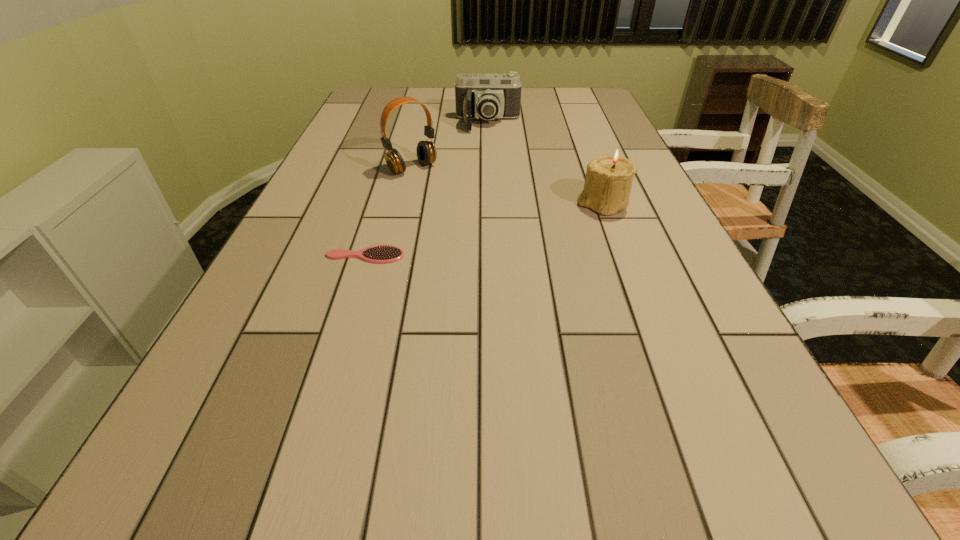
This screenshot has width=960, height=540. I want to click on unoccupied position between the second farthest object and the camera, so click(450, 146).

The width and height of the screenshot is (960, 540). I want to click on empty space between the third farthest object and the farthest object, so click(546, 164).

This screenshot has width=960, height=540. Find the location of `empty space that is in between the candle_holder and the hairbrush`. empty space that is in between the candle_holder and the hairbrush is located at coordinates (484, 230).

Find the location of a particular element. Image resolution: width=960 pixels, height=540 pixels. object that is the second nearest to the headset is located at coordinates (377, 254).

This screenshot has width=960, height=540. In order to click on object that is the nearest to the third farthest object in this screenshot , I will do `click(488, 96)`.

Find the location of `vacant point that satisfies the following two spatial constraints: 1. on the back side of the camera; 2. on the left side of the third nearest object`. vacant point that satisfies the following two spatial constraints: 1. on the back side of the camera; 2. on the left side of the third nearest object is located at coordinates (422, 124).

In order to click on vacant space that satisfies the following two spatial constraints: 1. on the back side of the third farthest object; 2. on the left side of the shortest object in this screenshot , I will do `click(381, 204)`.